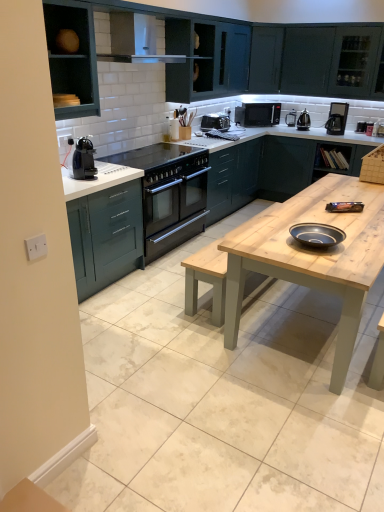
You are a GUI agent. You are given a task and a screenshot of the screen. Output one action in this format:
    pyautogui.click(x=<x>, y=<y>)
    Task: Click on the vacant space in front of matte blue bowl at center
    The height and width of the screenshot is (512, 384).
    Given the screenshot: What is the action you would take?
    pyautogui.click(x=347, y=262)